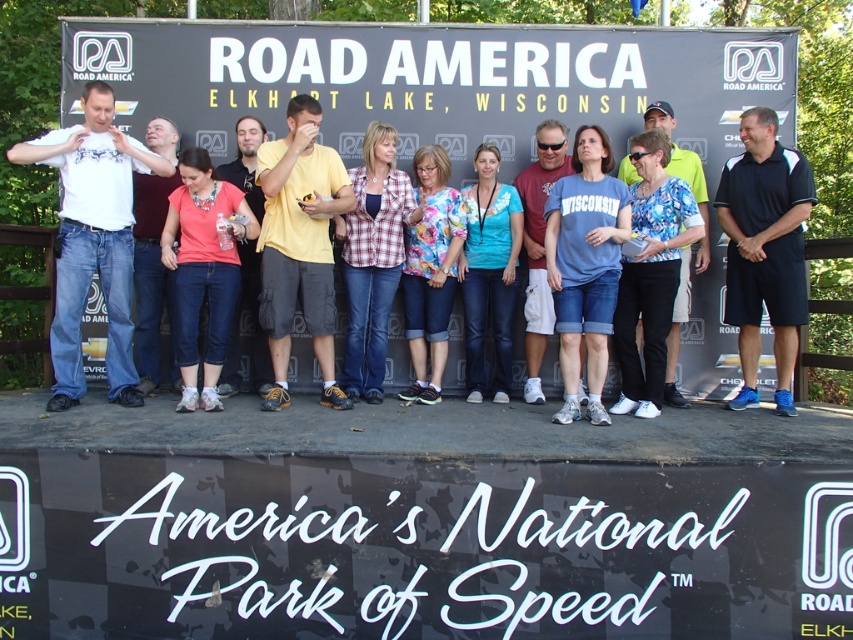
Question: Does black/dry fit shirt at right appear under blue cotton shirt at center?

Choices:
 (A) yes
 (B) no

Answer: (B)

Question: Does blue cotton shirt at center have a larger size compared to blue floral blouse at center?

Choices:
 (A) yes
 (B) no

Answer: (A)

Question: Which point appears closest to the camera in this image?

Choices:
 (A) (300, 102)
 (B) (61, 140)

Answer: (B)

Question: Which point is farther to the camera?

Choices:
 (A) matte yellow shirt at center
 (B) black fabric sign at center

Answer: (B)

Question: Is white cotton shirt at left positioned at the back of pink fabric shirt at center?

Choices:
 (A) yes
 (B) no

Answer: (B)

Question: Estimate the real-world distances between objects in this image. Which object is closer to the blue cotton shirt at center?

Choices:
 (A) floral fabric shirt at center
 (B) matte blue t-shirt at center
 (C) matte yellow shirt at center
 (D) yellow cotton shirt at center

Answer: (B)